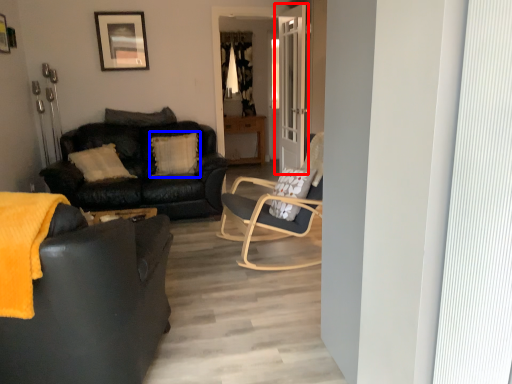
Question: Which point is further to the camera, door (highlighted by a red box) or pillow (highlighted by a blue box)?

Choices:
 (A) door
 (B) pillow

Answer: (B)